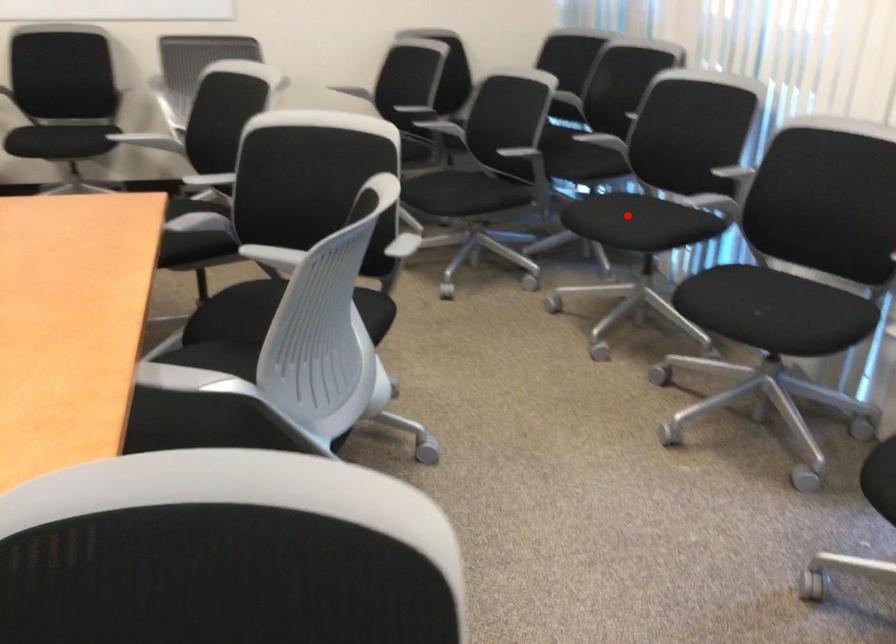
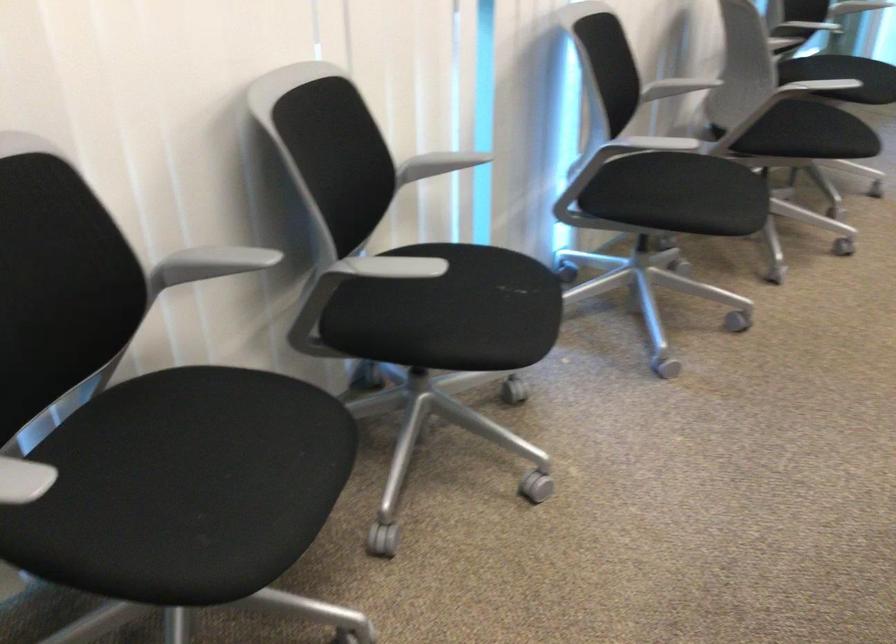
The point at the highlighted location is marked in the first image. Where is the corresponding point in the second image?

(226, 456)